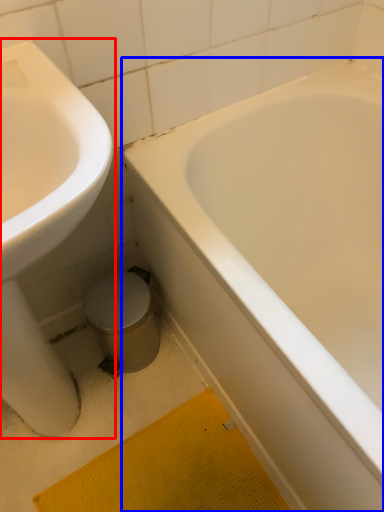
Question: Among these objects, which one is farthest to the camera, sink (highlighted by a red box) or bathtub (highlighted by a blue box)?

Choices:
 (A) sink
 (B) bathtub

Answer: (B)